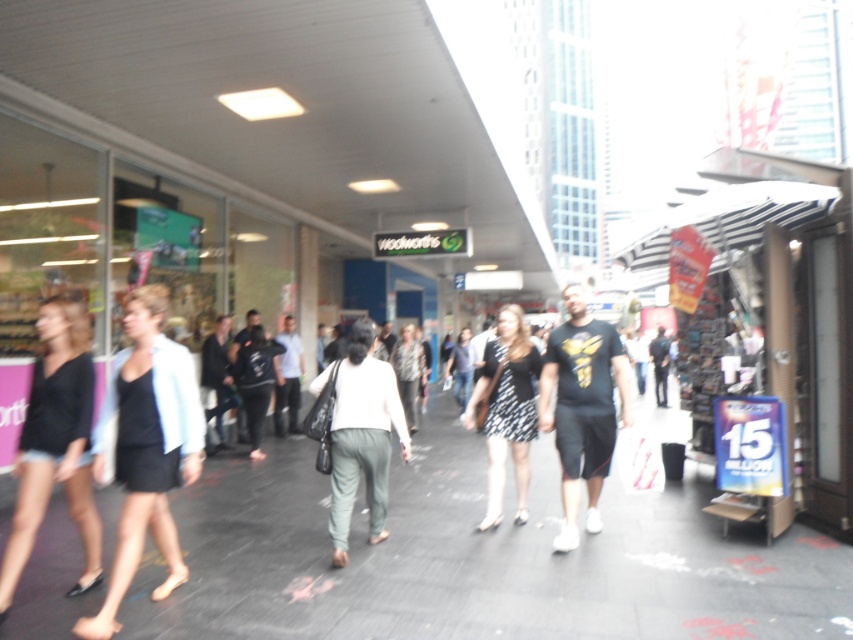
Between light gray cotton pants at center and dark gray jacket at center, which one has less height?

light gray cotton pants at center

Which is in front, point (347, 512) or point (202, 369)?

Positioned in front is point (347, 512).

This screenshot has height=640, width=853. What do you see at coordinates (363, 436) in the screenshot?
I see `light gray cotton pants at center` at bounding box center [363, 436].

Find the location of a particular element. The height and width of the screenshot is (640, 853). light gray cotton pants at center is located at coordinates (363, 436).

Does point (613, 332) lie in front of point (236, 417)?

Yes, point (613, 332) is in front of point (236, 417).

Who is lower down, black matte t-shirt at center or dark blue jeans at center?

black matte t-shirt at center is lower down.

The height and width of the screenshot is (640, 853). I want to click on black matte t-shirt at center, so click(582, 406).

Describe the element at coordinates (363, 436) in the screenshot. I see `light gray cotton pants at center` at that location.

Which is more to the right, light gray cotton pants at center or black dotted dress at center?

Positioned to the right is black dotted dress at center.

Does point (347, 477) lie behind point (532, 433)?

No, (347, 477) is closer to viewer.

At what (x,y) coordinates should I click in order to perform the action: click on light gray cotton pants at center. Please return your answer as a coordinate pair (x, y). Looking at the image, I should click on (363, 436).